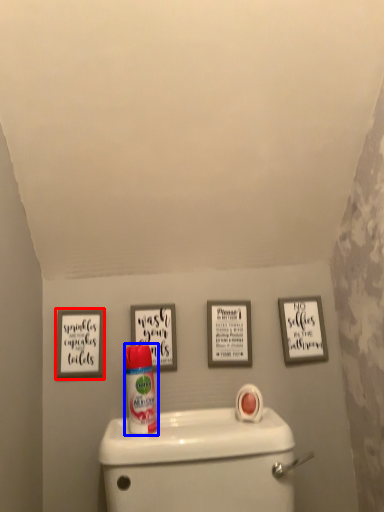
Question: Which object appears farthest to the camera in this image, picture frame (highlighted by a red box) or cleaning product (highlighted by a blue box)?

Choices:
 (A) picture frame
 (B) cleaning product

Answer: (A)